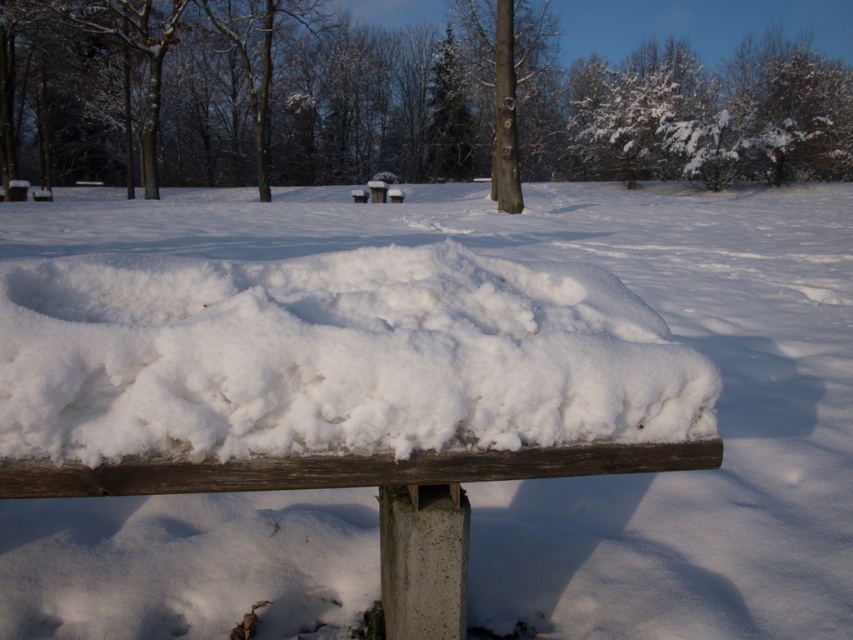
Consider the image. Can you confirm if white fluffy snow at center is positioned below smooth bark tree at center?

Indeed, white fluffy snow at center is positioned under smooth bark tree at center.

Does point (50, 458) lie behind point (515, 1)?

No, (50, 458) is in front of (515, 1).

Measure the distance between white fluffy snow at center and camera.

white fluffy snow at center and camera are 1.26 meters apart.

In order to click on white fluffy snow at center in this screenshot , I will do `click(334, 356)`.

Who is shorter, snow-covered tree at upper center or smooth bark tree at center?

snow-covered tree at upper center is shorter.

Is snow-covered tree at upper center positioned before smooth bark tree at center?

No, it is not.

Is point (341, 156) closer to camera compared to point (529, 12)?

No.

I want to click on snow-covered tree at upper center, so click(x=393, y=99).

Is point (207, 150) positioned behind point (207, 308)?

Yes, point (207, 150) is farther from viewer.

Which is in front, point (334, 131) or point (291, 381)?

Point (291, 381) is more forward.

I want to click on snow-covered tree at upper center, so click(x=393, y=99).